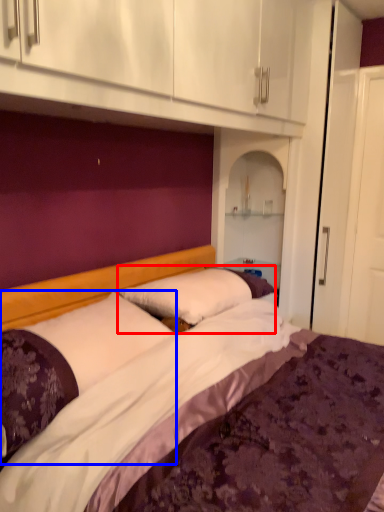
Question: Which object is closer to the camera taking this photo, pillow (highlighted by a red box) or pillow (highlighted by a blue box)?

Choices:
 (A) pillow
 (B) pillow

Answer: (B)